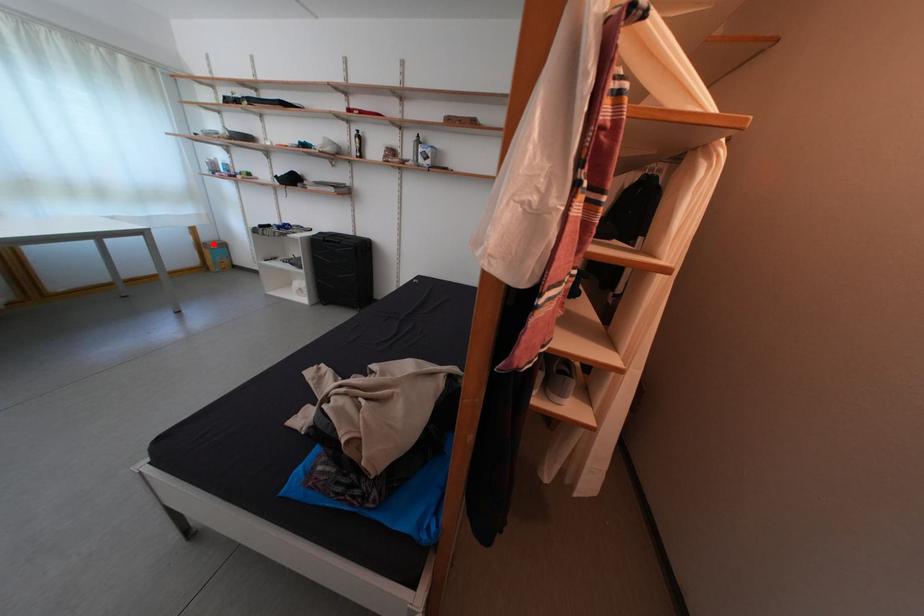
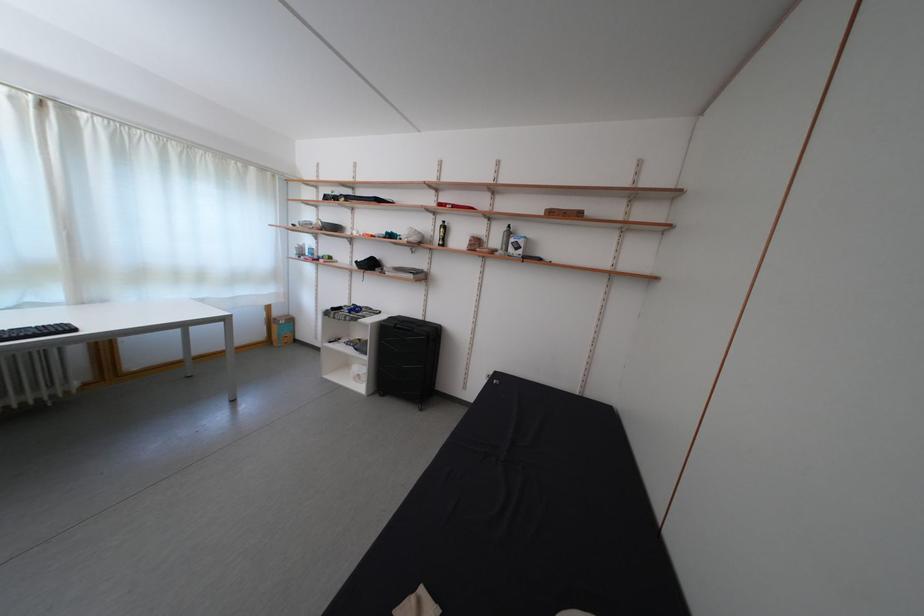
Question: A red point is marked in image1. In image2, is the corresponding 3D point closer to the camera or farther? Reply with the corresponding letter.

Choices:
 (A) The corresponding 3D point is closer.
 (B) The corresponding 3D point is farther.

Answer: (B)